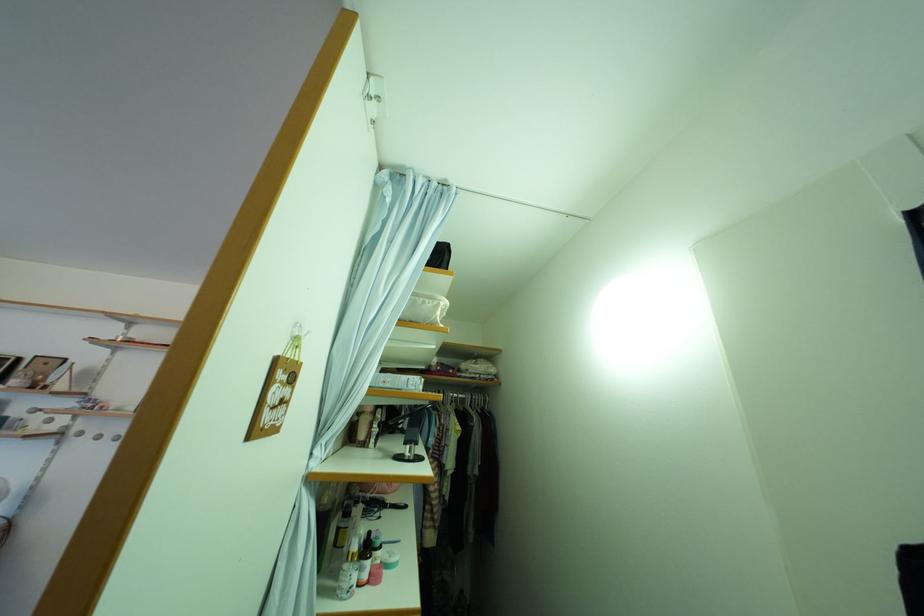
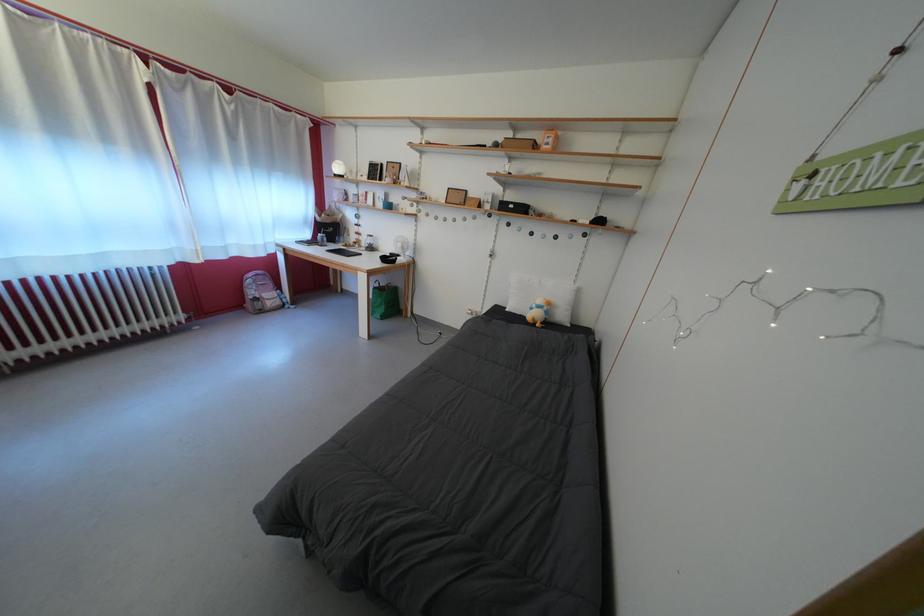
The images are taken continuously from a first-person perspective. In which direction is your viewpoint rotating?

The rotation direction of the camera is left-down.